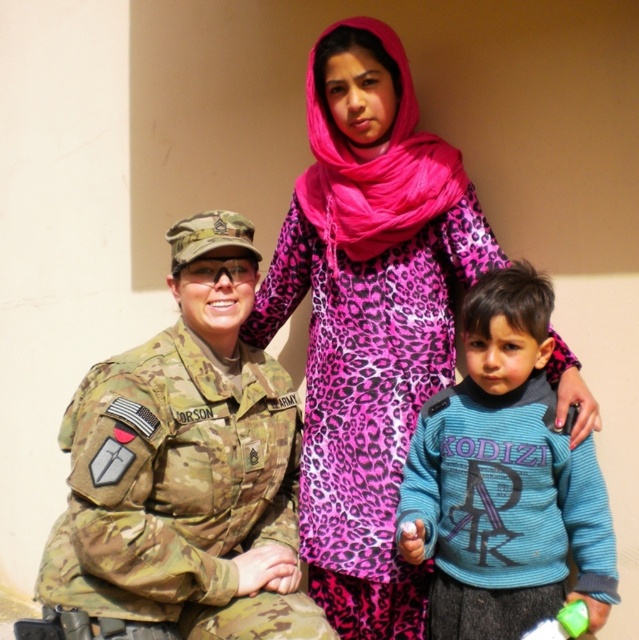
Who is taller, camo fabric uniform at left or blue fleece sweater at center?

With more height is blue fleece sweater at center.

Between point (98, 568) and point (465, 531), which one is positioned in front?

Positioned in front is point (98, 568).

Who is more forward, (x=181, y=445) or (x=525, y=595)?

Point (x=525, y=595)

Where is `camo fabric uniform at left`? This screenshot has width=639, height=640. camo fabric uniform at left is located at coordinates (178, 492).

Who is more forward, (298, 509) or (70, 488)?

Positioned in front is point (70, 488).

Based on the photo, can you confirm if pink leopard print dress at center is wider than camo fabric uniform at left?

Indeed, pink leopard print dress at center has a greater width compared to camo fabric uniform at left.

The height and width of the screenshot is (640, 639). I want to click on pink leopard print dress at center, so click(367, 316).

You are a GUI agent. You are given a task and a screenshot of the screen. Output one action in this format:
    pyautogui.click(x=<x>, y=<y>)
    Task: Click on the pink leopard print dress at center
    This screenshot has height=640, width=639.
    Given the screenshot: What is the action you would take?
    pyautogui.click(x=367, y=316)

Between pink leopard print dress at center and blue fleece sweater at center, which one is positioned lower?

blue fleece sweater at center

Which is above, pink leopard print dress at center or blue fleece sweater at center?

pink leopard print dress at center

Is point (339, 600) closer to viewer compared to point (429, 449)?

No, (339, 600) is behind (429, 449).

Where is `pink leopard print dress at center`? The image size is (639, 640). pink leopard print dress at center is located at coordinates (x=367, y=316).